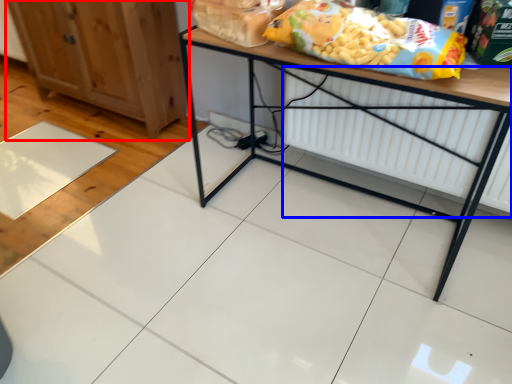
Question: Which object is further to the camera taking this photo, cabinetry (highlighted by a red box) or radiator (highlighted by a blue box)?

Choices:
 (A) cabinetry
 (B) radiator

Answer: (A)